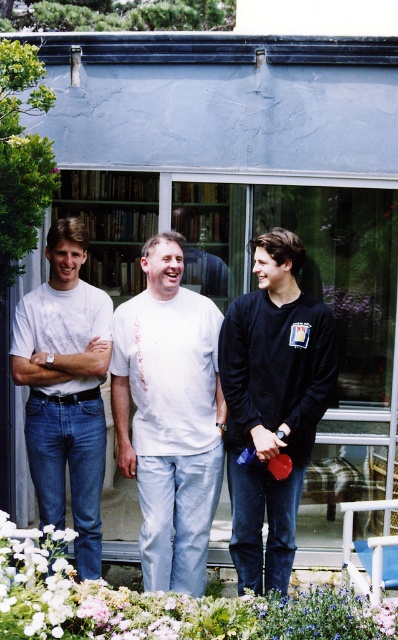
Looking at this image, which is more to the left, white matte shirt at center or white matte flower at lower center?

white matte shirt at center is more to the left.

Is point (130, 317) behind point (130, 589)?

No, (130, 317) is closer to viewer.

Locate an element on the screen. Image resolution: width=398 pixels, height=640 pixels. white matte shirt at center is located at coordinates (169, 417).

Is white matte shirt at center above matte white t-shirt at left?

No, white matte shirt at center is not above matte white t-shirt at left.

Who is higher up, white matte shirt at center or matte white t-shirt at left?

Positioned higher is matte white t-shirt at left.

I want to click on white matte shirt at center, so click(169, 417).

Can you confirm if matte white t-shirt at left is taller than wooden bookshelf at center?

Indeed, matte white t-shirt at left has a greater height compared to wooden bookshelf at center.

Between matte white t-shirt at left and wooden bookshelf at center, which one is positioned lower?

matte white t-shirt at left

Image resolution: width=398 pixels, height=640 pixels. Describe the element at coordinates (66, 388) in the screenshot. I see `matte white t-shirt at left` at that location.

Where is `matte white t-shirt at left`? The image size is (398, 640). matte white t-shirt at left is located at coordinates (66, 388).